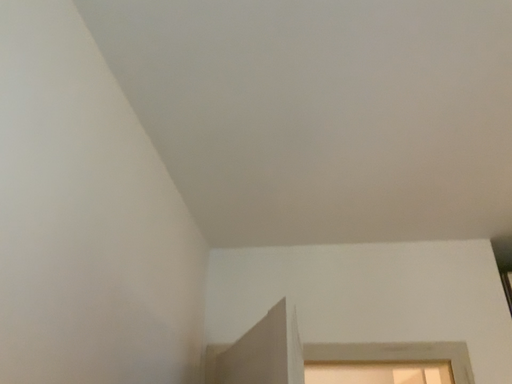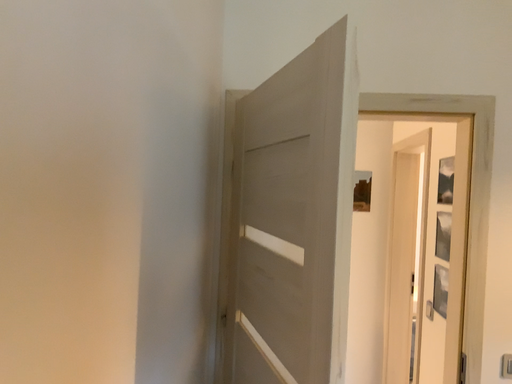
Question: How did the camera likely rotate when shooting the video?

Choices:
 (A) rotated upward
 (B) rotated downward

Answer: (B)